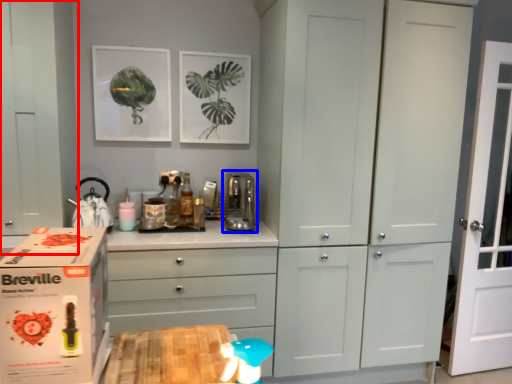
Question: Which object appears closest to the camera in this image, cabinetry (highlighted by a red box) or appliance (highlighted by a blue box)?

Choices:
 (A) cabinetry
 (B) appliance

Answer: (A)